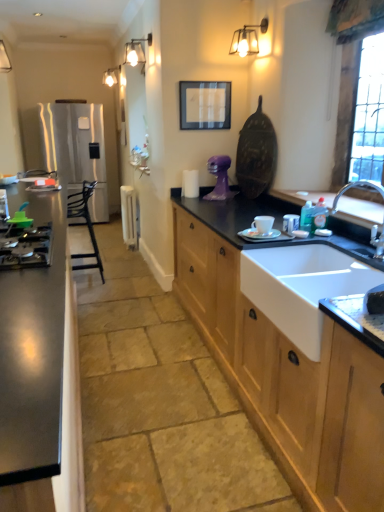
Question: From the image's perspective, is white ceramic cup at center, the first appliance in the right-to-left sequence, over chrome metallic faucet at sink right?

Choices:
 (A) no
 (B) yes

Answer: (A)

Question: Is white ceramic cup at center, placed as the third appliance when sorted from left to right, positioned behind chrome metallic faucet at sink right?

Choices:
 (A) no
 (B) yes

Answer: (B)

Question: Can you confirm if white ceramic cup at center, marked as the 1th appliance in a front-to-back arrangement, is taller than chrome metallic faucet at sink right?

Choices:
 (A) yes
 (B) no

Answer: (B)

Question: From the image's perspective, is white ceramic cup at center, which appears as the 3th appliance when viewed from the back, under chrome metallic faucet at sink right?

Choices:
 (A) no
 (B) yes

Answer: (B)

Question: Does white ceramic cup at center, which appears as the 3th appliance when viewed from the back, have a greater width compared to chrome metallic faucet at sink right?

Choices:
 (A) no
 (B) yes

Answer: (A)

Question: From a real-world perspective, is wooden cabinet at lower right, the 1th cabinetry when ordered from right to left, positioned above or below satin silver refrigerator at left?

Choices:
 (A) below
 (B) above

Answer: (A)

Question: In the image, is wooden cabinet at lower right, the 2th cabinetry in the left-to-right sequence, positioned in front of or behind satin silver refrigerator at left?

Choices:
 (A) behind
 (B) front

Answer: (B)

Question: In the image, is wooden cabinet at lower right, the 2th cabinetry in the left-to-right sequence, on the left side or the right side of satin silver refrigerator at left?

Choices:
 (A) left
 (B) right

Answer: (B)

Question: Is wooden cabinet at lower right, the 2th cabinetry in the left-to-right sequence, spatially inside satin silver refrigerator at left, or outside of it?

Choices:
 (A) inside
 (B) outside

Answer: (B)

Question: Looking at the image, does clear glass window at upper right seem bigger or smaller compared to purple matte sculpture at center, positioned as the 2th appliance in right-to-left order?

Choices:
 (A) small
 (B) big

Answer: (B)

Question: Considering the positions of clear glass window at upper right and purple matte sculpture at center, positioned as the 2th appliance in right-to-left order, in the image, is clear glass window at upper right wider or thinner than purple matte sculpture at center, positioned as the 2th appliance in right-to-left order,?

Choices:
 (A) wide
 (B) thin

Answer: (B)

Question: Considering the positions of clear glass window at upper right and purple matte sculpture at center, which is the 2th appliance from left to right, in the image, is clear glass window at upper right taller or shorter than purple matte sculpture at center, which is the 2th appliance from left to right,?

Choices:
 (A) tall
 (B) short

Answer: (A)

Question: Considering their positions, is clear glass window at upper right located in front of or behind purple matte sculpture at center, which is the 2th appliance from left to right?

Choices:
 (A) front
 (B) behind

Answer: (A)

Question: Considering their positions, is white ceramic sink at lower right located in front of or behind stainless steel cabinet at left, arranged as the 2th cabinetry when viewed from the right?

Choices:
 (A) behind
 (B) front

Answer: (A)

Question: From their relative heights in the image, would you say white ceramic sink at lower right is taller or shorter than stainless steel cabinet at left, arranged as the 2th cabinetry when viewed from the right?

Choices:
 (A) short
 (B) tall

Answer: (A)